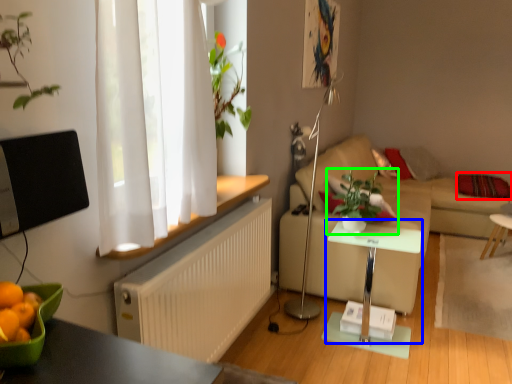
Question: Estimate the real-world distances between objects in this image. Which object is farther from pillow (highlighted by a red box), table (highlighted by a blue box) or houseplant (highlighted by a green box)?

Choices:
 (A) table
 (B) houseplant

Answer: (A)